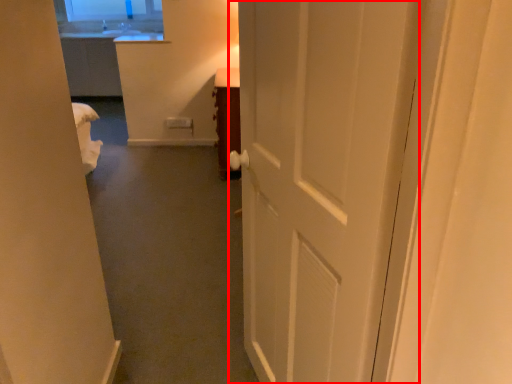
Question: In this image, where is door (annotated by the red box) located relative to furniture?

Choices:
 (A) left
 (B) right

Answer: (B)